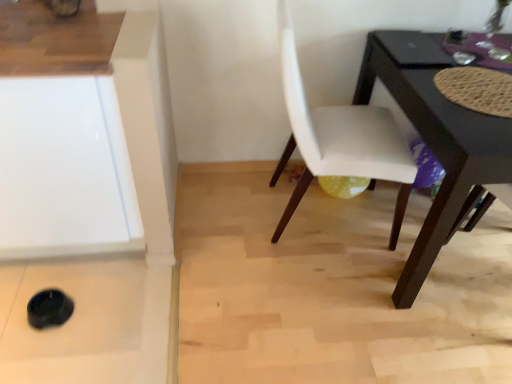
Locate an element on the screen. The image size is (512, 384). vacant area situated to the left side of white leather chair at center is located at coordinates (223, 222).